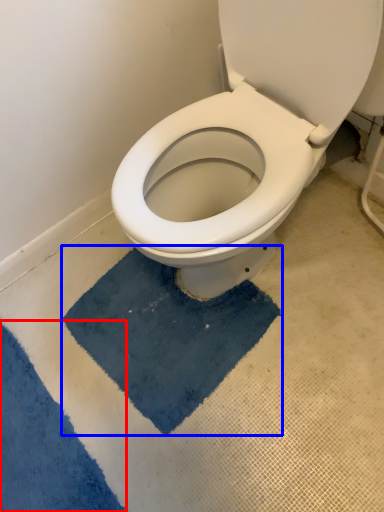
Question: Which object is closer to the camera taking this photo, bath mat (highlighted by a red box) or bath mat (highlighted by a blue box)?

Choices:
 (A) bath mat
 (B) bath mat

Answer: (A)